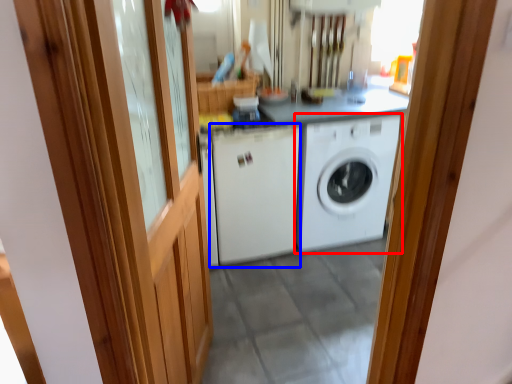
Question: Which object appears closest to the camera in this image, washing machine (highlighted by a red box) or washing machine (highlighted by a blue box)?

Choices:
 (A) washing machine
 (B) washing machine

Answer: (B)